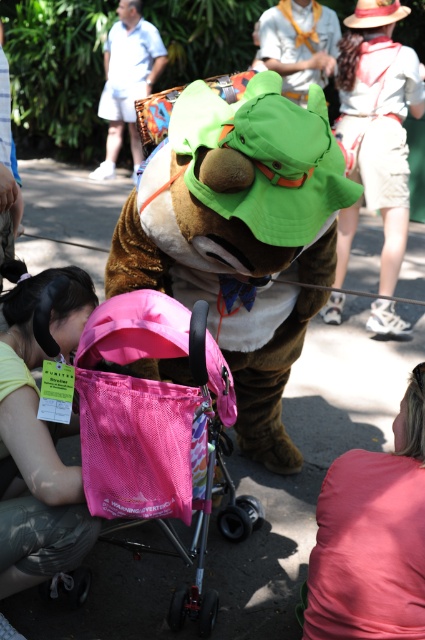
You are a photographer standing at the center of the scene. You want to take a photo that includes both the brown furry mascot at center and the white cotton shirt at upper right. Given that your camera has a maximum focal length that allows capturing objects up to 3 meters apart in the frame, will you be able to include both in the same photo?

The brown furry mascot at center and the white cotton shirt at upper right are 3.48 meters apart. Since the maximum distance your camera can capture is 3 meters, you will not be able to include both in the same photo.